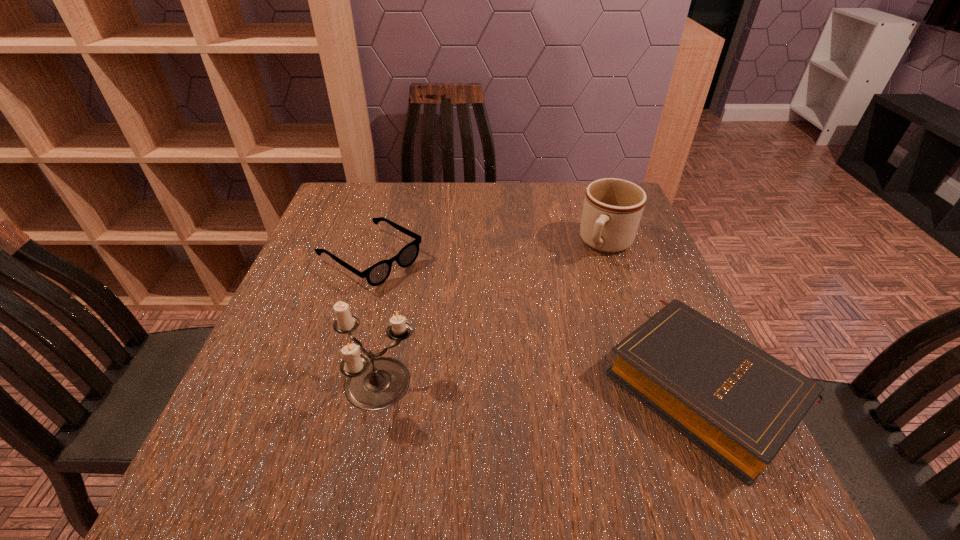
I want to click on free location located 0.080m on the side of the mug with the handle, so click(587, 280).

Where is `free space located on the side of the mug with the handle`? free space located on the side of the mug with the handle is located at coordinates (568, 308).

At what (x,y) coordinates should I click in order to perform the action: click on object located at the far edge. Please return your answer as a coordinate pair (x, y). The height and width of the screenshot is (540, 960). Looking at the image, I should click on (612, 209).

Identify the location of candle holder at the near edge. This screenshot has width=960, height=540. (374, 383).

This screenshot has height=540, width=960. Find the location of `Bible that is at the near edge`. Bible that is at the near edge is located at coordinates (739, 404).

Locate an element on the screen. This screenshot has width=960, height=540. object that is at the left edge is located at coordinates (377, 274).

This screenshot has height=540, width=960. In order to click on Bible situated at the right edge in this screenshot , I will do `click(739, 404)`.

Find the location of a particular element. This screenshot has width=960, height=540. mug located at the right edge is located at coordinates (612, 209).

This screenshot has width=960, height=540. Identify the location of object that is positioned at the far right corner. (612, 209).

Locate an element on the screen. object situated at the near right corner is located at coordinates (739, 404).